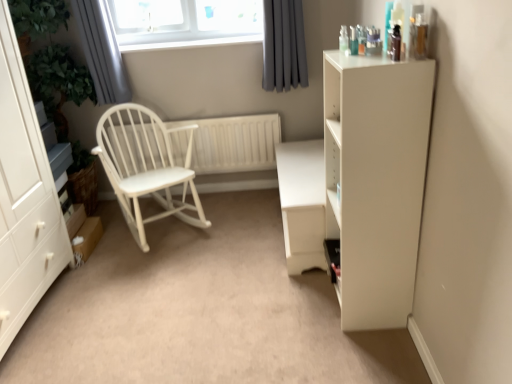
Question: Can you confirm if gray fabric curtain at upper center, acting as the second curtain starting from the left, is thinner than white matte table at center?

Choices:
 (A) no
 (B) yes

Answer: (B)

Question: Can you confirm if gray fabric curtain at upper center, acting as the second curtain starting from the left, is shorter than white matte table at center?

Choices:
 (A) no
 (B) yes

Answer: (A)

Question: Is gray fabric curtain at upper center, which is counted as the 1th curtain, starting from the right, bigger than white matte table at center?

Choices:
 (A) yes
 (B) no

Answer: (B)

Question: Is white matte table at center surrounded by gray fabric curtain at upper center, acting as the second curtain starting from the left?

Choices:
 (A) no
 (B) yes

Answer: (A)

Question: Is gray fabric curtain at upper center, acting as the second curtain starting from the left, far from white matte table at center?

Choices:
 (A) no
 (B) yes

Answer: (A)

Question: Is the position of gray fabric curtain at upper center, acting as the second curtain starting from the left, less distant than that of white matte table at center?

Choices:
 (A) no
 (B) yes

Answer: (A)

Question: From the image's perspective, would you say gray fabric curtain at upper center, acting as the second curtain starting from the left, is positioned over white matte cabinet at right?

Choices:
 (A) no
 (B) yes

Answer: (B)

Question: Considering the relative sizes of gray fabric curtain at upper center, which is counted as the 1th curtain, starting from the right, and white matte cabinet at right in the image provided, is gray fabric curtain at upper center, which is counted as the 1th curtain, starting from the right, bigger than white matte cabinet at right?

Choices:
 (A) yes
 (B) no

Answer: (B)

Question: Is white matte cabinet at right at the back of gray fabric curtain at upper center, which is counted as the 1th curtain, starting from the right?

Choices:
 (A) no
 (B) yes

Answer: (A)

Question: Can you confirm if gray fabric curtain at upper center, which is counted as the 1th curtain, starting from the right, is smaller than white matte cabinet at right?

Choices:
 (A) no
 (B) yes

Answer: (B)

Question: Is the position of gray fabric curtain at upper center, acting as the second curtain starting from the left, less distant than that of white matte cabinet at right?

Choices:
 (A) yes
 (B) no

Answer: (B)

Question: Are gray fabric curtain at upper center, acting as the second curtain starting from the left, and white matte cabinet at right far apart?

Choices:
 (A) yes
 (B) no

Answer: (A)

Question: From the image's perspective, is white wood radiator at center on top of white matte cabinet at left?

Choices:
 (A) no
 (B) yes

Answer: (B)